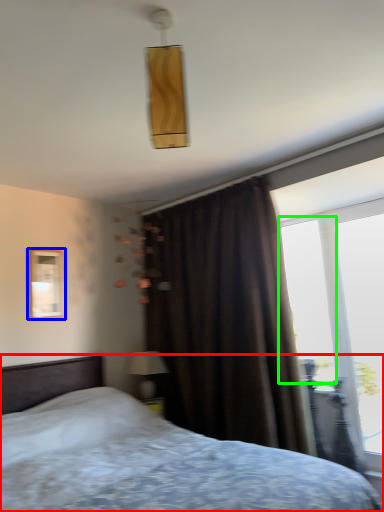
Question: Based on their relative distances, which object is farther from bed (highlighted by a red box)? Choose from picture frame (highlighted by a blue box) and window screen (highlighted by a green box).

Choices:
 (A) picture frame
 (B) window screen

Answer: (A)